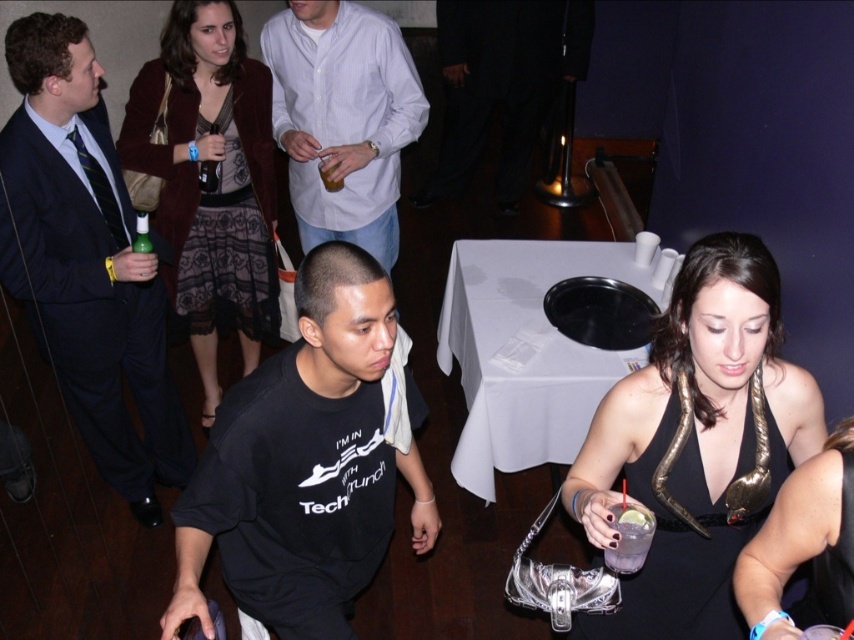
Measure the distance from black satin dress at lower right to clear glass drink at lower right.

black satin dress at lower right is 10.56 inches away from clear glass drink at lower right.

From the picture: Which is below, black satin dress at lower right or clear glass drink at lower right?

clear glass drink at lower right is lower down.

Who is more forward, (769, 273) or (607, 561)?

Point (769, 273)

This screenshot has height=640, width=854. In order to click on black satin dress at lower right in this screenshot , I will do `click(697, 444)`.

Is black satin dress at lower right wider than patterned fabric dress at center?

Correct, the width of black satin dress at lower right exceeds that of patterned fabric dress at center.

Is point (700, 381) more distant than point (247, 371)?

No.

At what (x,y) coordinates should I click in order to perform the action: click on black satin dress at lower right. Please return your answer as a coordinate pair (x, y). This screenshot has width=854, height=640. Looking at the image, I should click on (697, 444).

Which is below, patterned fabric dress at center or clear glass drink at lower right?

Positioned lower is clear glass drink at lower right.

Can you confirm if patterned fabric dress at center is positioned above clear glass drink at lower right?

Yes, patterned fabric dress at center is above clear glass drink at lower right.

Is point (197, 273) positioned in front of point (623, 552)?

That is False.

Locate an element on the screen. The width and height of the screenshot is (854, 640). patterned fabric dress at center is located at coordinates (209, 179).